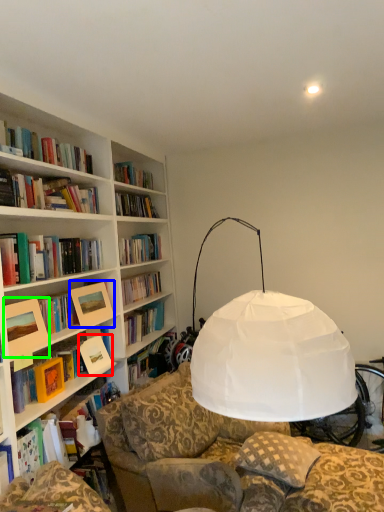
Question: Which is farther away from paperback book (highlighted by a red box)? picture frame (highlighted by a blue box) or picture frame (highlighted by a green box)?

Choices:
 (A) picture frame
 (B) picture frame

Answer: (B)